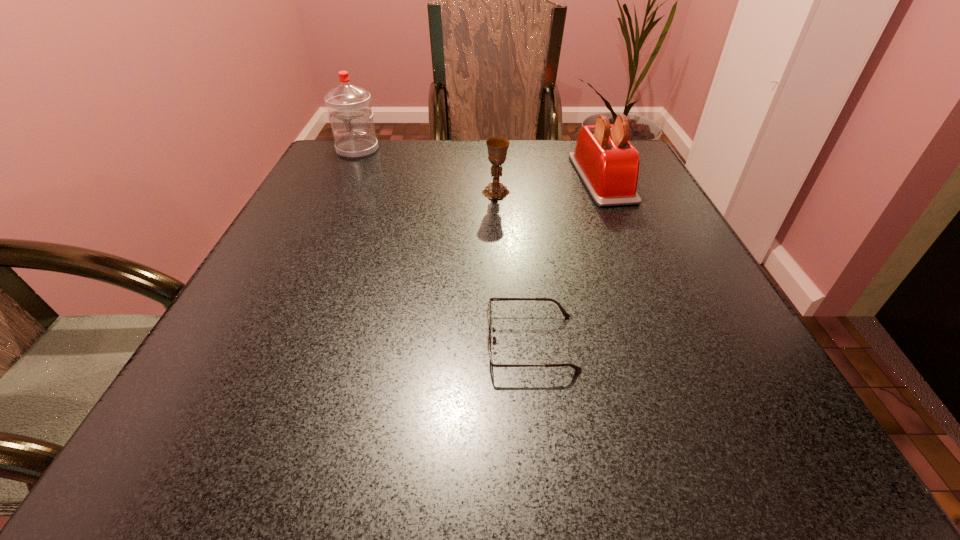
The height and width of the screenshot is (540, 960). I want to click on the tallest object, so click(349, 107).

Find the location of a particular element. The width and height of the screenshot is (960, 540). the leftmost object is located at coordinates (349, 107).

Where is `the second tallest object`? The width and height of the screenshot is (960, 540). the second tallest object is located at coordinates (608, 164).

Identify the location of the rightmost object. The height and width of the screenshot is (540, 960). (608, 164).

You are a GUI agent. You are given a task and a screenshot of the screen. Output one action in this format:
    pyautogui.click(x=<x>, y=<y>)
    Task: Click on the second shortest object
    The width and height of the screenshot is (960, 540).
    Given the screenshot: What is the action you would take?
    click(497, 147)

The width and height of the screenshot is (960, 540). I want to click on the nearest object, so click(489, 312).

The image size is (960, 540). I want to click on the shortest object, so click(489, 312).

Identify the location of blank area located 0.320m on the handle side of the tallest object. This screenshot has height=540, width=960. 321,227.

I want to click on vacant space located on the left of the third shortest object, so click(500, 178).

You are a GUI agent. You are given a task and a screenshot of the screen. Output one action in this format:
    pyautogui.click(x=<x>, y=<y>)
    Task: Click on the free location located on the left of the chalice
    The width and height of the screenshot is (960, 540).
    Given the screenshot: What is the action you would take?
    pyautogui.click(x=398, y=192)